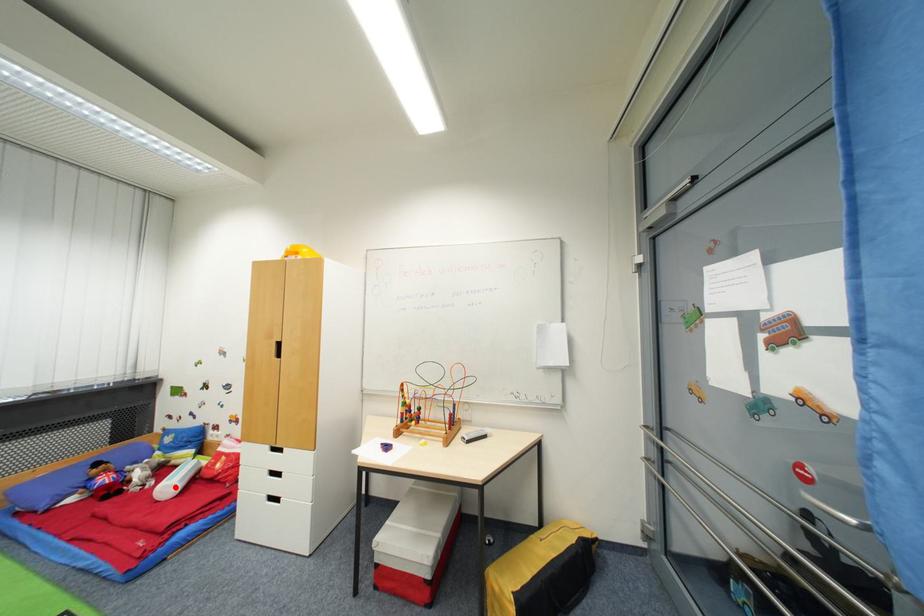
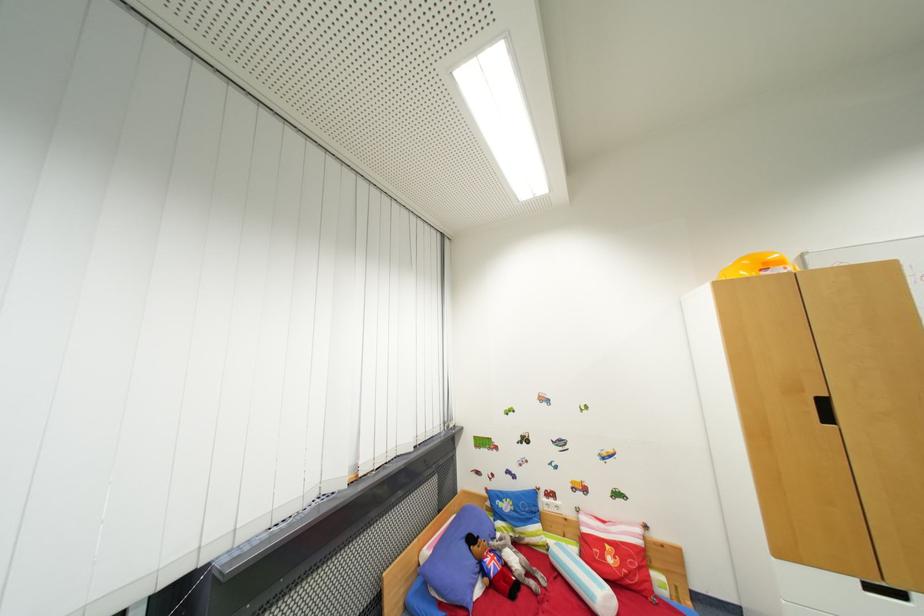
The point at the highlighted location is marked in the first image. Where is the corresponding point in the second image?

(605, 596)